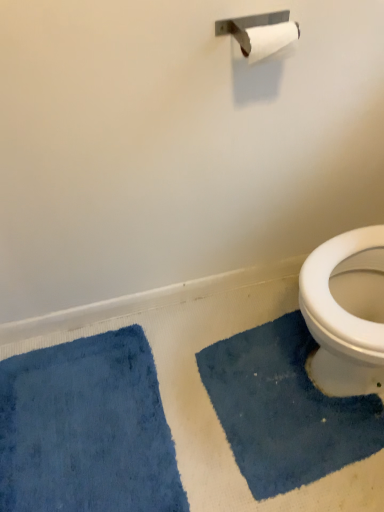
Where is `free space that is in between blue plush bath mat at lower left, placed as the 1th bath mat when sorted from left to right, and blue plush bath mat at lower right, arranged as the first bath mat when viewed from the right`? free space that is in between blue plush bath mat at lower left, placed as the 1th bath mat when sorted from left to right, and blue plush bath mat at lower right, arranged as the first bath mat when viewed from the right is located at coordinates (196, 388).